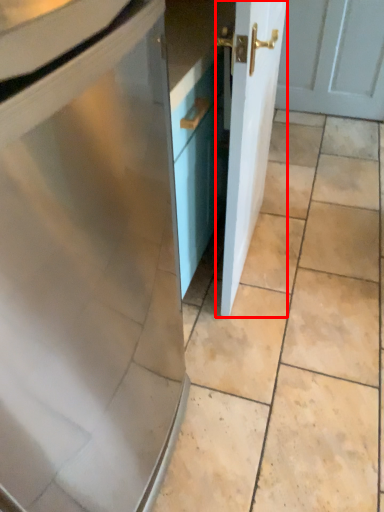
Question: From the image, what is the correct spatial relationship of door (annotated by the red box) in relation to ceramic tile?

Choices:
 (A) left
 (B) right

Answer: (B)